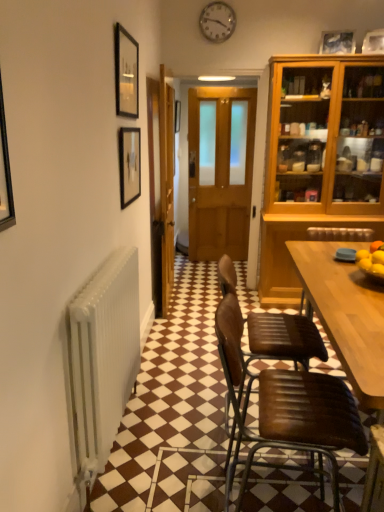
Question: From a real-world perspective, is wooden door at center, arranged as the first door when viewed from the left, located beneath brown leather chair at lower right, acting as the first chair starting from the front?

Choices:
 (A) no
 (B) yes

Answer: (A)

Question: Is brown leather chair at lower right, acting as the first chair starting from the front, surrounded by wooden door at center, positioned as the second door in right-to-left order?

Choices:
 (A) yes
 (B) no

Answer: (B)

Question: Is wooden door at center, positioned as the second door in right-to-left order, wider than brown leather chair at lower right, the second chair viewed from the back?

Choices:
 (A) yes
 (B) no

Answer: (B)

Question: Does wooden door at center, arranged as the first door when viewed from the left, appear on the right side of brown leather chair at lower right, acting as the first chair starting from the front?

Choices:
 (A) yes
 (B) no

Answer: (B)

Question: Is wooden door at center, arranged as the first door when viewed from the left, beside brown leather chair at lower right, the second chair viewed from the back?

Choices:
 (A) no
 (B) yes

Answer: (A)

Question: Is wooden door at center, arranged as the first door when viewed from the left, aimed at brown leather chair at lower right, acting as the first chair starting from the front?

Choices:
 (A) no
 (B) yes

Answer: (A)

Question: Does wooden door at center, positioned as the second door in right-to-left order, appear on the right side of matte black picture frame at upper left, positioned as the second picture frame in right-to-left order?

Choices:
 (A) no
 (B) yes

Answer: (B)

Question: Is wooden door at center, positioned as the second door in right-to-left order, not close to matte black picture frame at upper left, arranged as the third picture frame when viewed from the back?

Choices:
 (A) yes
 (B) no

Answer: (B)

Question: From the image's perspective, is wooden door at center, arranged as the first door when viewed from the left, beneath matte black picture frame at upper left, positioned as the second picture frame in right-to-left order?

Choices:
 (A) no
 (B) yes

Answer: (B)

Question: From a real-world perspective, is wooden door at center, positioned as the second door in right-to-left order, below matte black picture frame at upper left, the second picture frame when ordered from left to right?

Choices:
 (A) yes
 (B) no

Answer: (A)

Question: Can you confirm if wooden door at center, positioned as the second door in right-to-left order, is wider than matte black picture frame at upper left, the 2th picture frame when ordered from top to bottom?

Choices:
 (A) yes
 (B) no

Answer: (A)

Question: Does wooden door at center, positioned as the second door in right-to-left order, have a smaller size compared to matte black picture frame at upper left, positioned as the second picture frame in right-to-left order?

Choices:
 (A) yes
 (B) no

Answer: (B)

Question: Considering the relative positions of matte black picture frame at upper left, arranged as the third picture frame when viewed from the back, and brown leather chair at lower right, the second chair viewed from the back, in the image provided, is matte black picture frame at upper left, arranged as the third picture frame when viewed from the back, to the right of brown leather chair at lower right, the second chair viewed from the back, from the viewer's perspective?

Choices:
 (A) yes
 (B) no

Answer: (B)